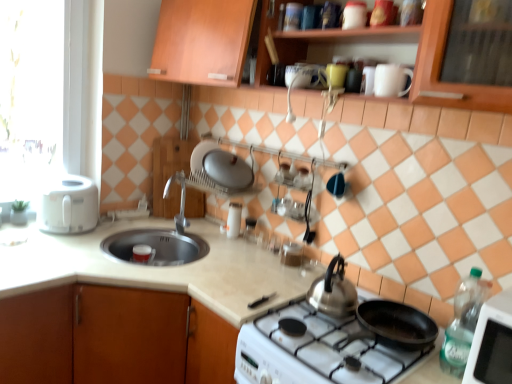
Question: Which direction should I rotate to face glossy ceramic mug at upper center, the 2th mug in the front-to-back sequence, — up or down?

Choices:
 (A) down
 (B) up

Answer: (B)

Question: Is glossy ceramic mug at upper center, the first mug from the top, next to beige laminate countertop at center, placed as the 1th countertop when sorted from left to right?

Choices:
 (A) yes
 (B) no

Answer: (B)

Question: Is glossy ceramic mug at upper center, the 2th mug from the bottom, bigger than beige laminate countertop at center, placed as the 1th countertop when sorted from left to right?

Choices:
 (A) no
 (B) yes

Answer: (A)

Question: Is the depth of glossy ceramic mug at upper center, the 2th mug from the bottom, less than that of beige laminate countertop at center, which is the second countertop from right to left?

Choices:
 (A) yes
 (B) no

Answer: (B)

Question: Could you tell me if glossy ceramic mug at upper center, which appears as the 1th mug when viewed from the back, is facing beige laminate countertop at center, placed as the 1th countertop when sorted from left to right?

Choices:
 (A) yes
 (B) no

Answer: (B)

Question: Is beige laminate countertop at center, which is the second countertop from right to left, surrounded by glossy ceramic mug at upper center, the first mug from the top?

Choices:
 (A) no
 (B) yes

Answer: (A)

Question: Is glossy ceramic mug at upper center, which appears as the 1th mug when viewed from the back, positioned behind beige laminate countertop at center, which is the second countertop from right to left?

Choices:
 (A) yes
 (B) no

Answer: (A)

Question: From the image's perspective, does white matte countertop at lower left, the first countertop positioned from the right, appear lower than white matte mug at upper center, positioned as the 2th mug in top-to-bottom order?

Choices:
 (A) no
 (B) yes

Answer: (B)

Question: Is white matte countertop at lower left, the first countertop positioned from the right, aimed at white matte mug at upper center, placed as the 1th mug when sorted from right to left?

Choices:
 (A) yes
 (B) no

Answer: (B)

Question: Is white matte countertop at lower left, which is the second countertop in left-to-right order, oriented away from white matte mug at upper center, positioned as the 2th mug in top-to-bottom order?

Choices:
 (A) yes
 (B) no

Answer: (B)

Question: From a real-world perspective, is white matte countertop at lower left, the first countertop positioned from the right, over white matte mug at upper center, which appears as the second mug when viewed from the back?

Choices:
 (A) no
 (B) yes

Answer: (A)

Question: Considering the relative sizes of white matte countertop at lower left, the first countertop positioned from the right, and white matte mug at upper center, which appears as the second mug when viewed from the back, in the image provided, is white matte countertop at lower left, the first countertop positioned from the right, taller than white matte mug at upper center, which appears as the second mug when viewed from the back,?

Choices:
 (A) yes
 (B) no

Answer: (A)

Question: Is white matte countertop at lower left, which is the second countertop in left-to-right order, outside of white matte mug at upper center, placed as the 1th mug when sorted from right to left?

Choices:
 (A) yes
 (B) no

Answer: (A)

Question: Can you confirm if white plastic toaster at left is shorter than beige laminate countertop at center, placed as the 1th countertop when sorted from left to right?

Choices:
 (A) yes
 (B) no

Answer: (B)